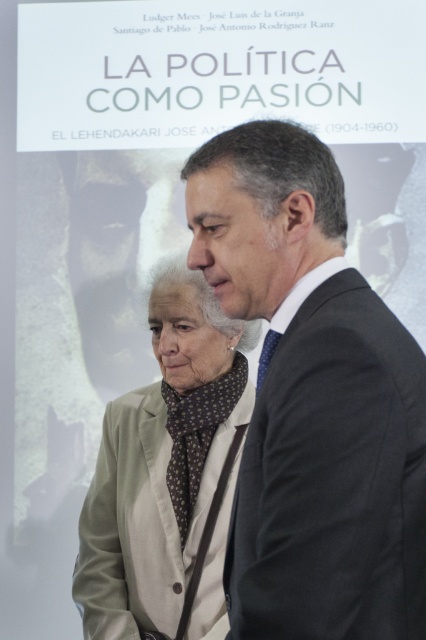
Question: Among these points, which one is nearest to the camera?

Choices:
 (A) (123, 518)
 (B) (181, 403)

Answer: (A)

Question: Which of the following is the closest to the observer?

Choices:
 (A) dark gray suit at center
 (B) brown dotted fabric bow tie at center

Answer: (A)

Question: Which is farther from the dark gray suit at center?

Choices:
 (A) brown dotted fabric bow tie at center
 (B) light beige fabric business suit at center

Answer: (A)

Question: Does dark gray suit at center have a greater width compared to light beige fabric business suit at center?

Choices:
 (A) no
 (B) yes

Answer: (A)

Question: Can you confirm if dark gray suit at center is thinner than light beige fabric business suit at center?

Choices:
 (A) no
 (B) yes

Answer: (B)

Question: Can you confirm if dark gray suit at center is thinner than light beige fabric business suit at center?

Choices:
 (A) no
 (B) yes

Answer: (B)